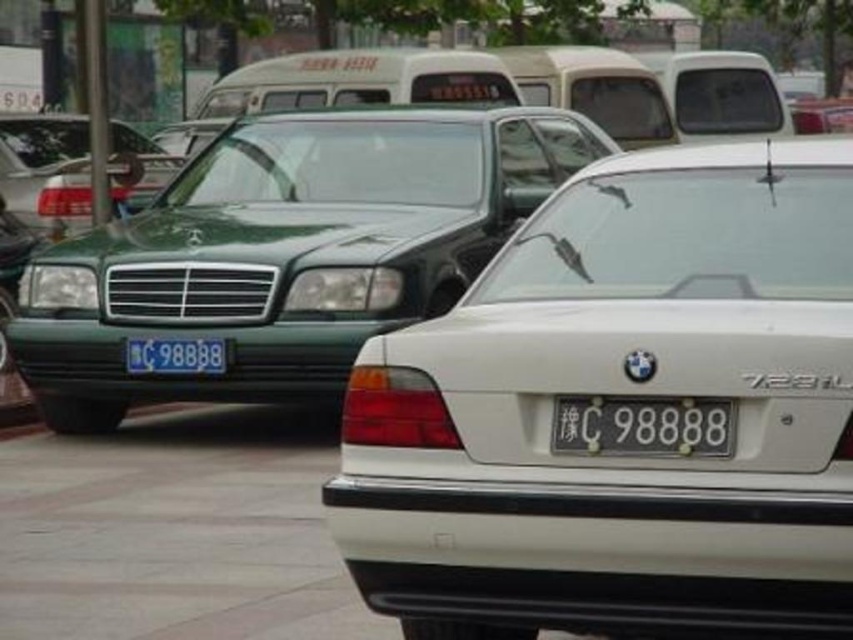
You are a delivery person trying to park your van on the gray concrete pavement at lower center. However, there is a green matte sedan at left blocking the entrance. Based on the scene, can you drive around the sedan to access the pavement?

The gray concrete pavement at lower center is in front of the green matte sedan at left, meaning the sedan is positioned in front of the pavement. This suggests the sedan is blocking the entrance, so you cannot drive around it to access the pavement.

You are standing on the sidewalk and looking at the street scene. You see the gray concrete pavement at lower center and the blue metallic license plate at center. Which object is located to the right side from your viewpoint?

The gray concrete pavement at lower center is to the right of the blue metallic license plate at center according to the description.

You are a delivery driver who needs to park your car between the two points marked in the image. The first point is point (56, 496) and the second point is point (223, 342). Which point should you park closer to in order to be in front of the other vehicles?

You should park closer to point (56, 496) because it is in front of point (223, 342), so parking there would place your car in front of the other vehicles.